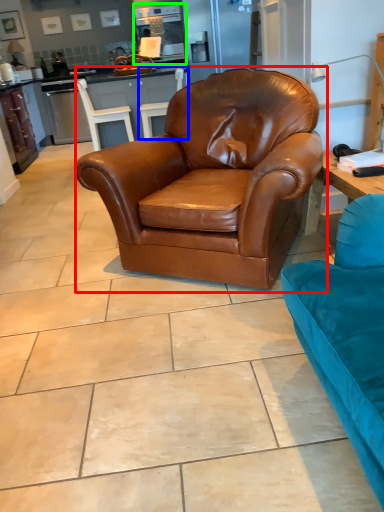
Question: Considering the real-world distances, which object is closest to chair (highlighted by a red box)? chair (highlighted by a blue box) or appliance (highlighted by a green box).

Choices:
 (A) chair
 (B) appliance

Answer: (A)